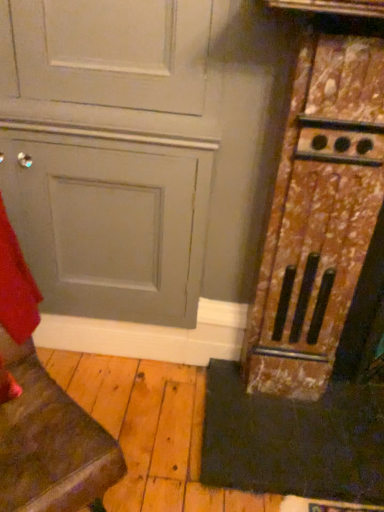
Question: In the image, is rusty wood stove at right on the left side or the right side of black rubber doormat at lower right?

Choices:
 (A) right
 (B) left

Answer: (A)

Question: Which is correct: rusty wood stove at right is inside black rubber doormat at lower right, or outside of it?

Choices:
 (A) inside
 (B) outside

Answer: (B)

Question: Considering the real-world distances, which object is closest to the matte gray door at lower left?

Choices:
 (A) matte gray door at center
 (B) black rubber doormat at lower right
 (C) rusty wood stove at right

Answer: (A)

Question: Which of these objects is positioned farthest from the matte gray door at center?

Choices:
 (A) matte gray door at lower left
 (B) black rubber doormat at lower right
 (C) rusty wood stove at right

Answer: (B)